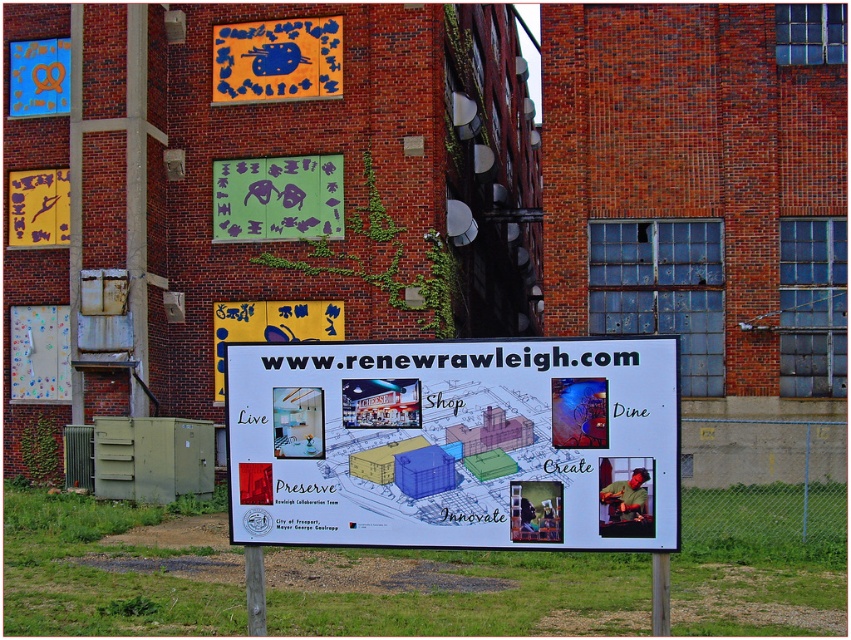
You are a pedestrian walking past the brick building and notice two signs at the center. The white paper sign at center and the yellow matte sign at center. Which one is larger?

The yellow matte sign at center is larger than the white paper sign at center.

You are a pedestrian walking past the building and notice the green matte sign at center and the blue fabric sign at upper center. Which sign is taller?

The blue fabric sign at upper center is taller than the green matte sign at center.